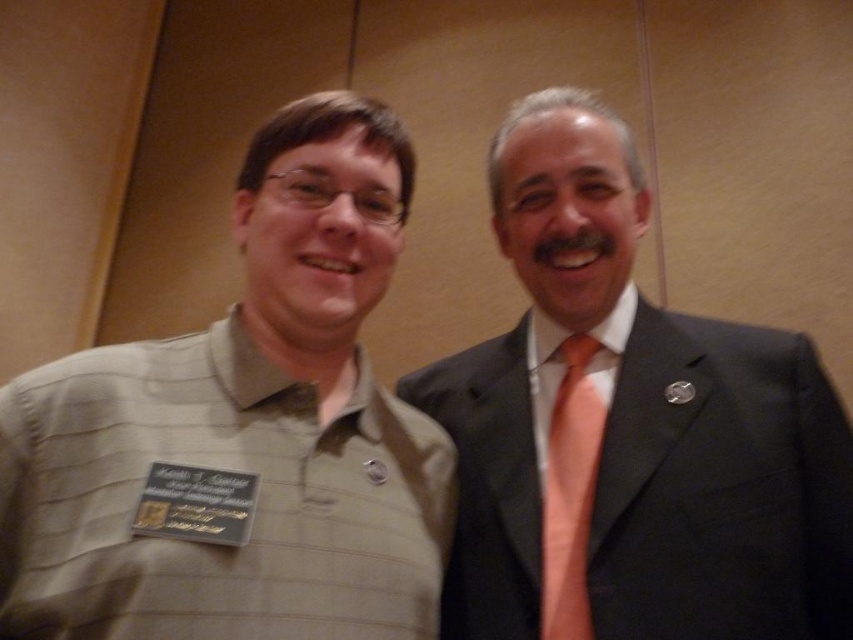
You are a photographer setting up for a group photo. You need to ensure there is enough space between the two subjects so that their clothing items do not overlap in the photo. The camera you are using has a minimum focus distance of 4 inches. Based on the scene description, will the current distance between the matte black suit at right and the orange silk tie at right allow for a clear, non overlapping photo?

The matte black suit at right is 4.23 inches from the orange silk tie at right. Since the minimum focus distance is 4 inches, the current distance of 4.23 inches is sufficient to ensure the clothing items do not overlap in the photo.